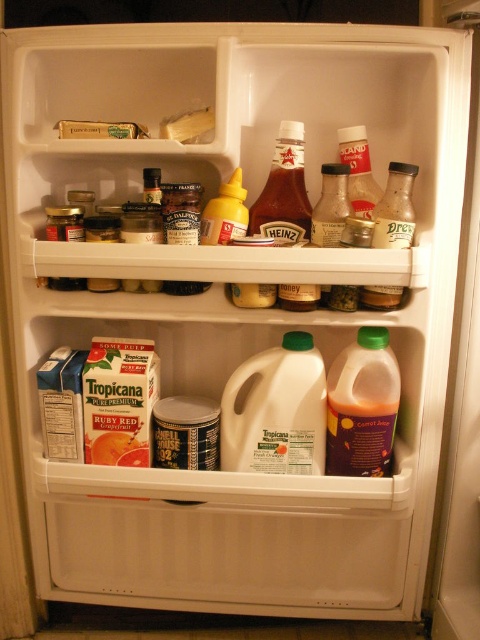
You need to place a 20 cm long ruler between the translucent plastic dressing bottle at upper right and the yellow glossy mustard at upper center. Will the ruler fit horizontally between them?

The distance between the translucent plastic dressing bottle at upper right and the yellow glossy mustard at upper center is 19.91 centimeters. Since the ruler is 20 cm long, it will not fit horizontally between them as the space is slightly smaller.

You need to pour milk from the white plastic jug at center into a glass. However, there is a yellow glossy mustard at upper center in the way. Can you pour the milk without moving the mustard?

A: The white plastic jug at center is taller than the yellow glossy mustard at upper center. Since the jug is taller, you can pour the milk by tilting the jug over the glass while keeping it above the mustard, avoiding contact.